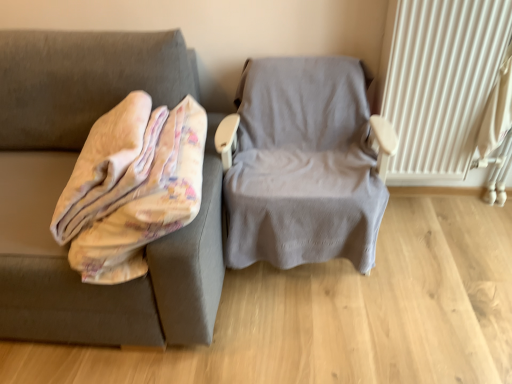
Question: Is white textured radiator at right taller or shorter than fluffy beige blanket at left?

Choices:
 (A) short
 (B) tall

Answer: (B)

Question: Would you say white textured radiator at right is to the left or to the right of fluffy beige blanket at left in the picture?

Choices:
 (A) right
 (B) left

Answer: (A)

Question: Estimate the real-world distances between objects in this image. Which object is farther from the gray fabric chair at center?

Choices:
 (A) fluffy beige blanket at left
 (B) white textured radiator at right

Answer: (A)

Question: Estimate the real-world distances between objects in this image. Which object is farther from the gray fabric chair at center?

Choices:
 (A) fluffy beige blanket at left
 (B) white textured radiator at right

Answer: (A)